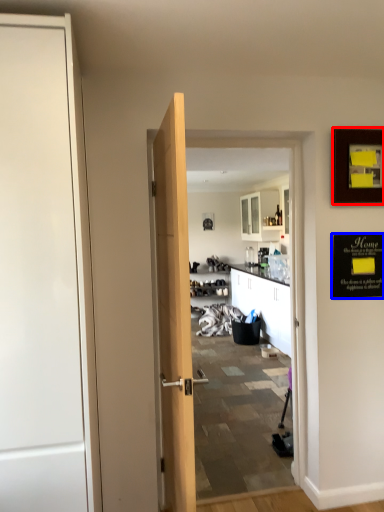
Question: Which of the following is the farthest to the observer, picture frame (highlighted by a red box) or bulletin board (highlighted by a blue box)?

Choices:
 (A) picture frame
 (B) bulletin board

Answer: (B)